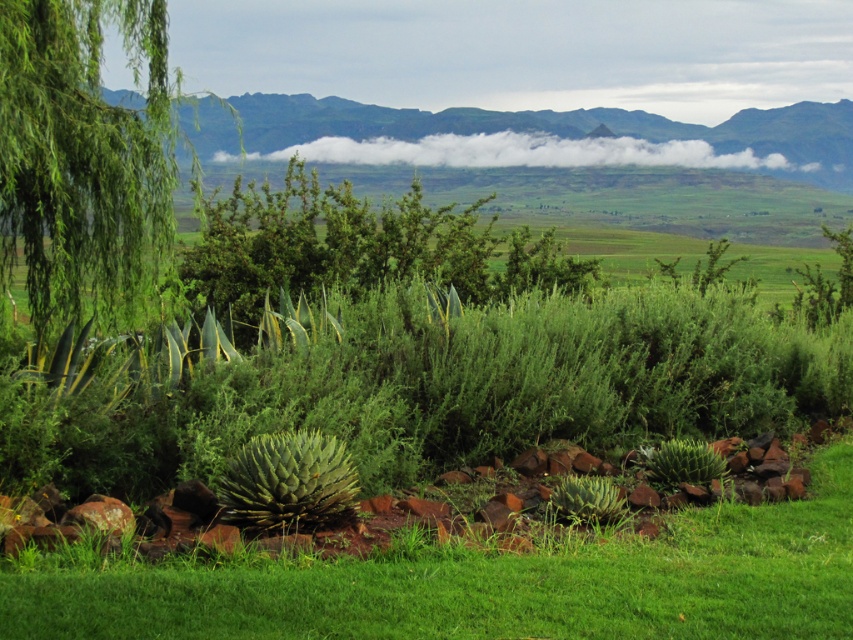
Which of these two, green grassy at center or green leafy tree at left, stands taller?

With more height is green leafy tree at left.

Is point (306, 586) farther from viewer compared to point (62, 260)?

No, it is not.

Find the location of a particular element. This screenshot has height=640, width=853. green grassy at center is located at coordinates (485, 582).

Between green leafy tree at left and green spiky plant at center, which one is positioned lower?

green spiky plant at center is below.

Between point (71, 65) and point (225, 484), which one is positioned in front?

Positioned in front is point (225, 484).

The image size is (853, 640). Identify the location of green leafy tree at left. (82, 154).

Is green grassy at center behind green spiky plant at center?

No.

Does green grassy at center have a larger size compared to green spiky plant at center?

Correct, green grassy at center is larger in size than green spiky plant at center.

Does point (547, 586) come in front of point (305, 465)?

Yes, point (547, 586) is in front of point (305, 465).

Locate an element on the screen. Image resolution: width=853 pixels, height=640 pixels. green grassy at center is located at coordinates (485, 582).